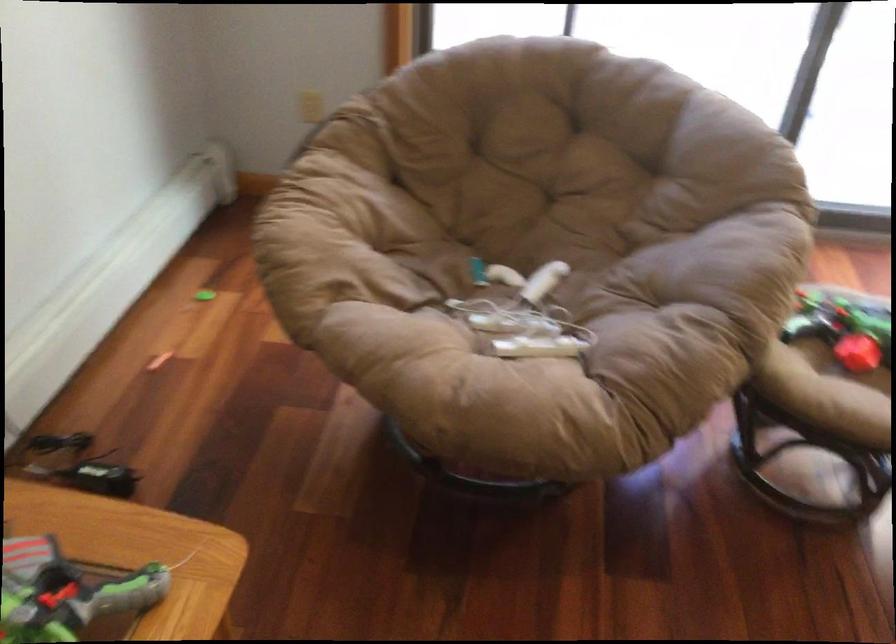
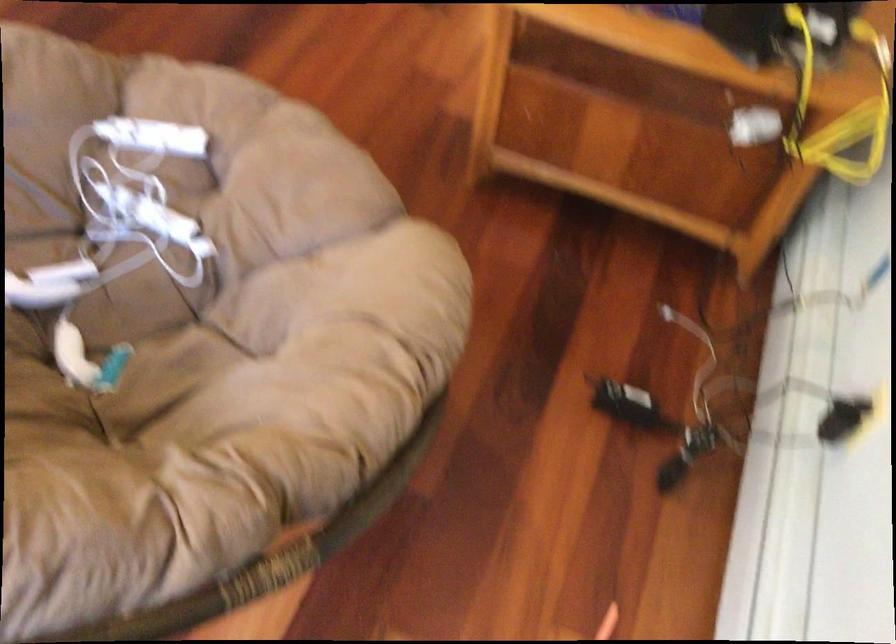
Locate, in the second image, the point that corresponds to (x=547, y=343) in the first image.

(152, 137)